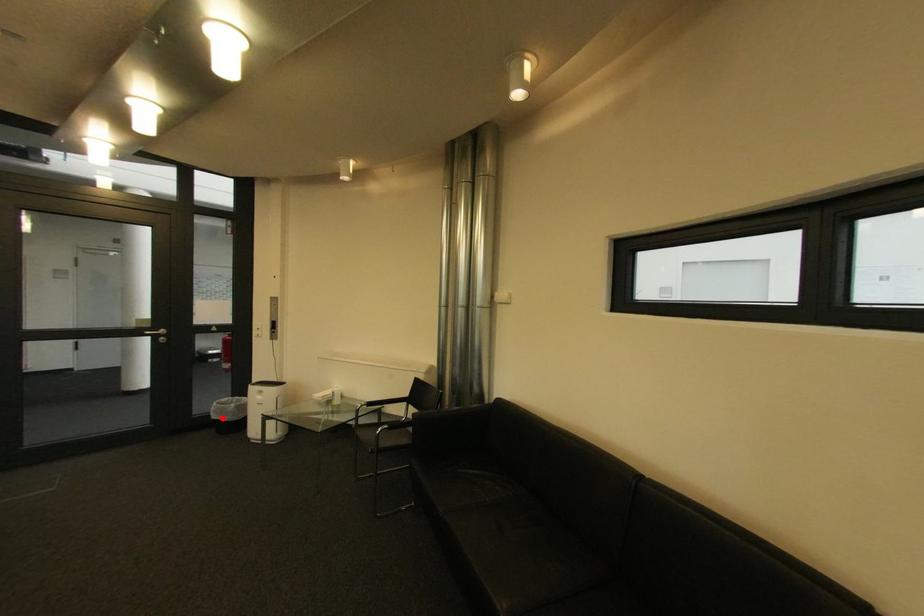
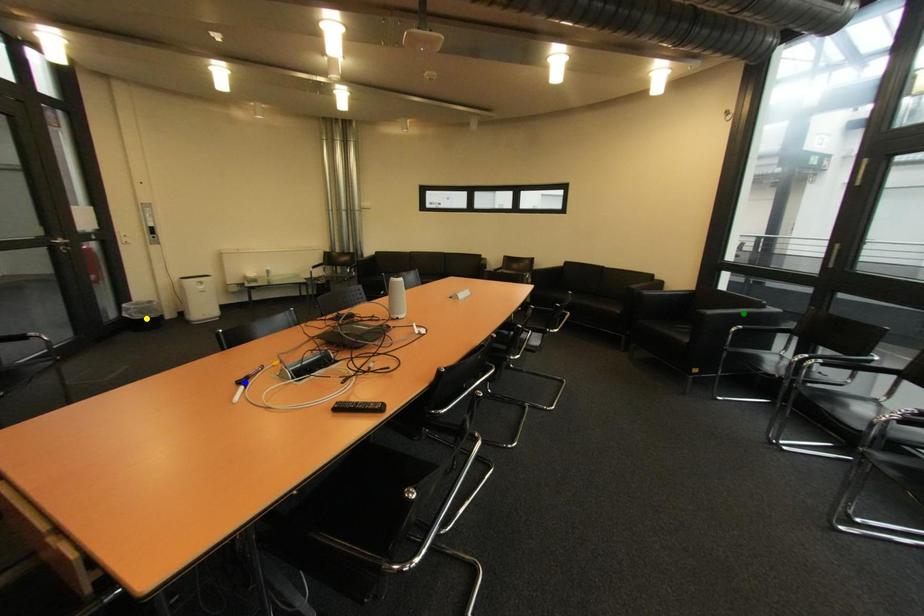
Question: I am providing you with two images of the same scene from different viewpoints. A red point is marked on the first image. You are given multiple points on the second image. Which spot in image 2 lines up with the point in image 1?

Choices:
 (A) blue point
 (B) yellow point
 (C) green point

Answer: (B)